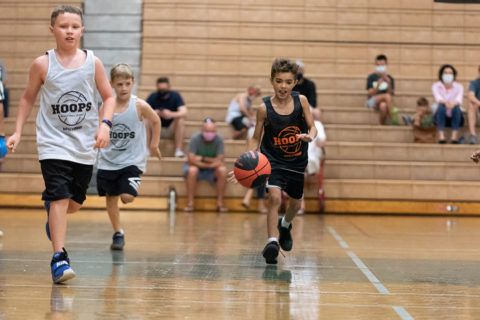
Find the location of a particular element. stands is located at coordinates (350, 143).